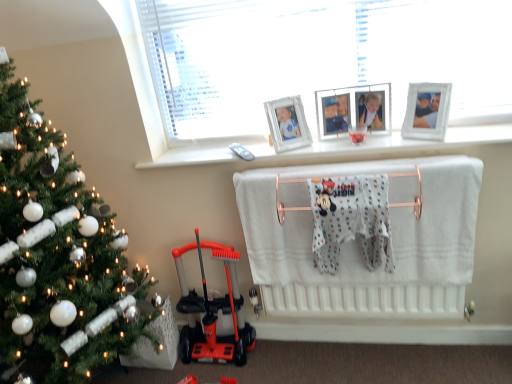
Locate an element on the screen. The height and width of the screenshot is (384, 512). free space to the left of white glossy picture frame at upper right, which ranks as the 2th picture frame in left-to-right order is located at coordinates (396, 153).